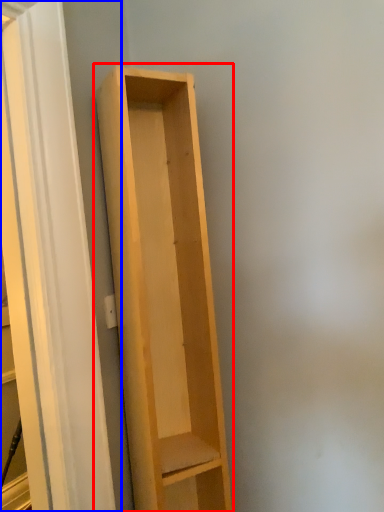
Question: Which point is closer to the camera, shelf (highlighted by a red box) or screen door (highlighted by a blue box)?

Choices:
 (A) shelf
 (B) screen door

Answer: (B)